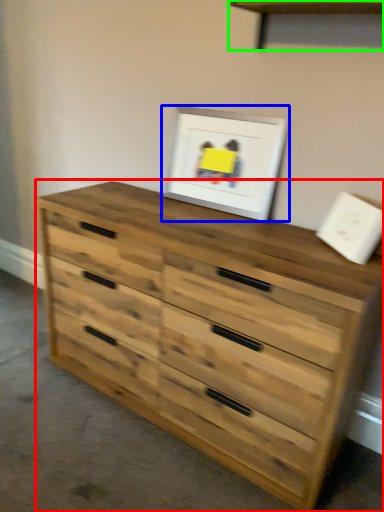
Question: Based on their relative distances, which object is farther from chest of drawers (highlighted by a red box)? Choose from picture frame (highlighted by a blue box) and shelf (highlighted by a green box).

Choices:
 (A) picture frame
 (B) shelf

Answer: (B)